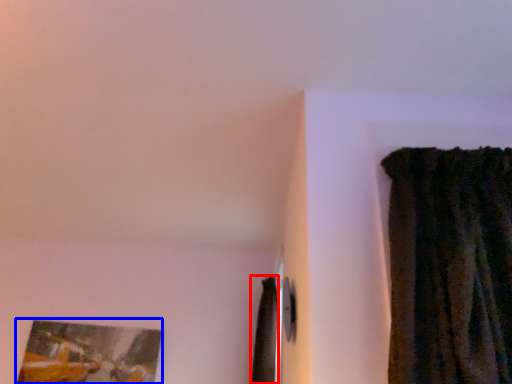
Question: Which point is further to the camera, curtain (highlighted by a red box) or picture frame (highlighted by a blue box)?

Choices:
 (A) curtain
 (B) picture frame

Answer: (B)